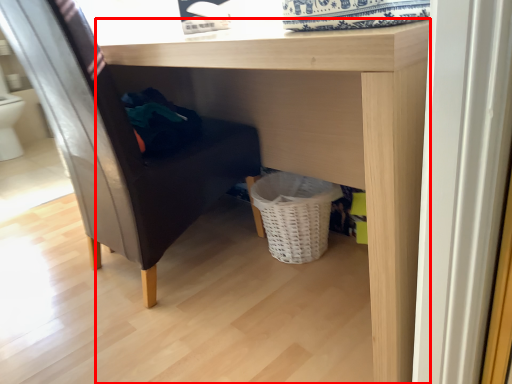
Question: From the image's perspective, where is table (annotated by the red box) located in relation to furniture in the image?

Choices:
 (A) above
 (B) below

Answer: (B)